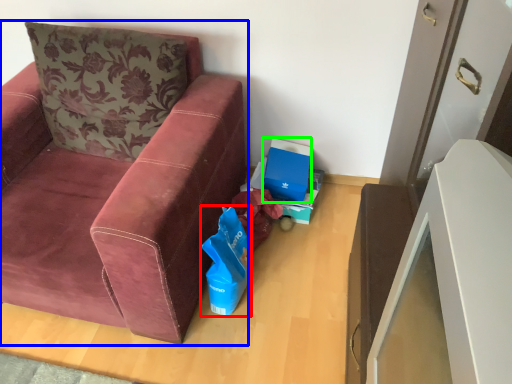
Question: Based on their relative distances, which object is nearer to gift bag (highlighted by a red box)? Choose from studio couch (highlighted by a blue box) and cardboard box (highlighted by a green box).

Choices:
 (A) studio couch
 (B) cardboard box

Answer: (A)